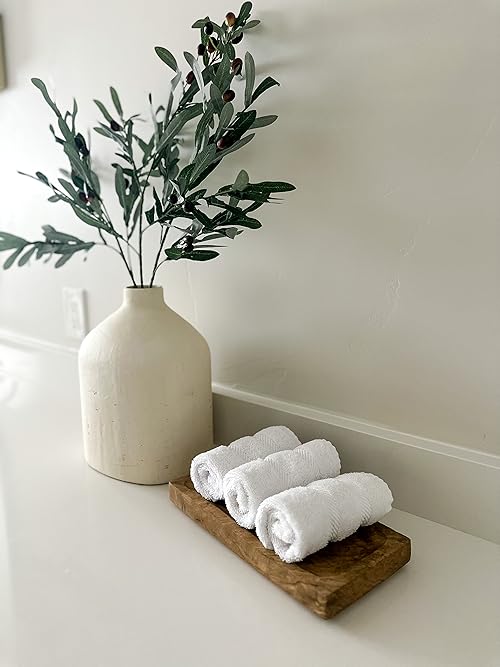
This screenshot has width=500, height=667. Identify the location of outlet. (x=75, y=305).